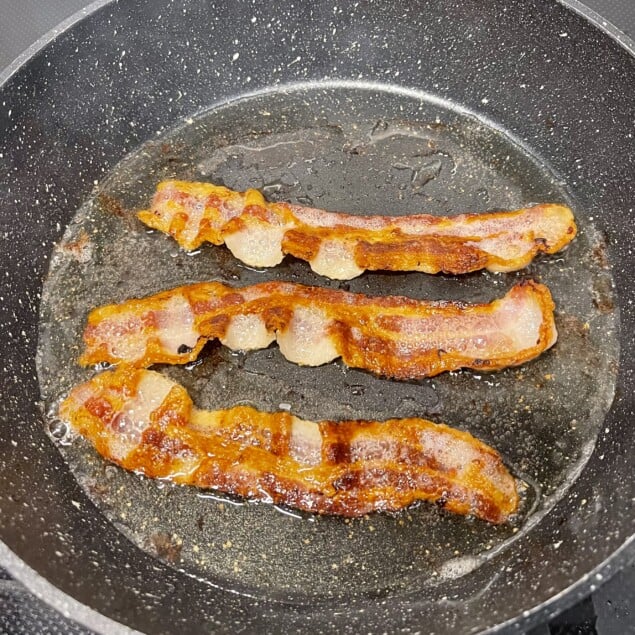
Find the location of a particular element. The width and height of the screenshot is (635, 635). inside bottom surface of frying pan is located at coordinates (261, 543), (351, 384), (555, 397), (100, 265), (351, 152), (401, 276).